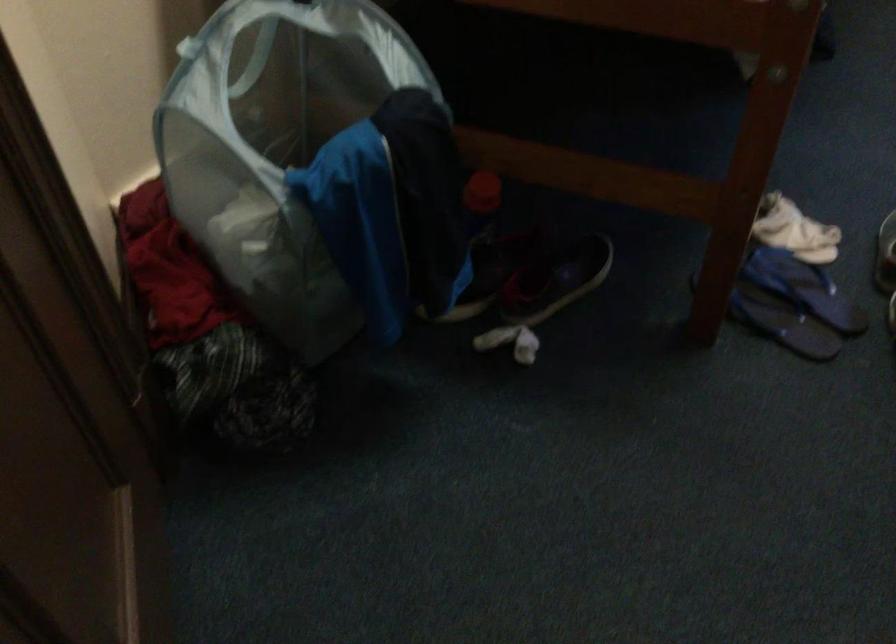
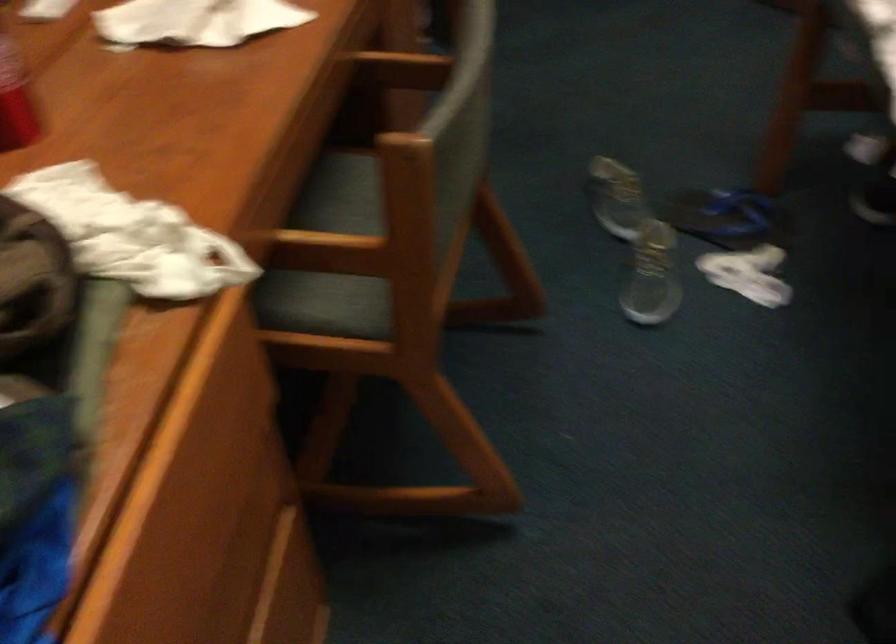
In the second image, find the point that corresponds to [786,276] in the first image.

(728, 218)